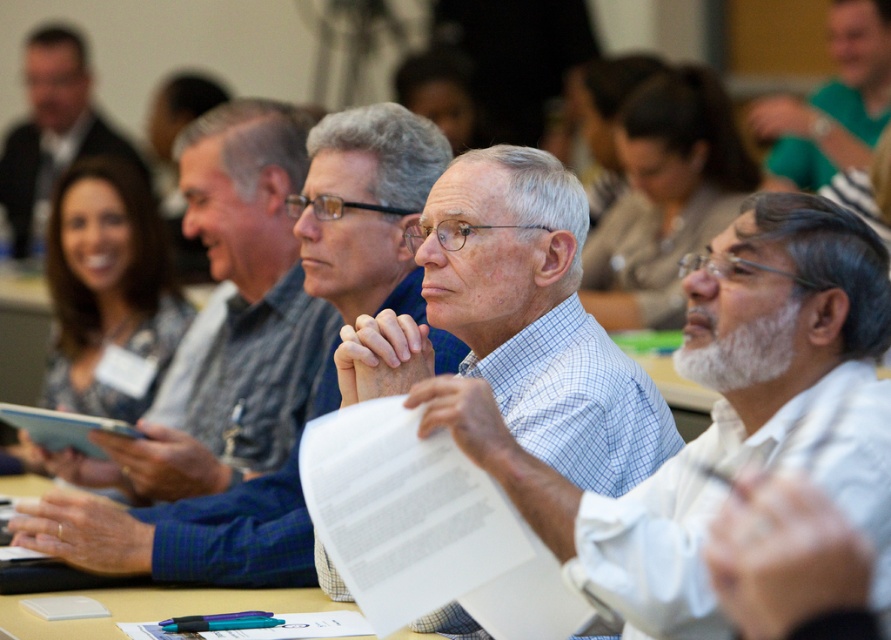
You are standing at the entrance of the conference room and see two points marked on the floor. The first point is at coordinate point [594,483] and the second point is at coordinate point [795,186]. Which point is closer to you?

Point [594,483] is in front of point [795,186], so it is closer to you.

Looking at this image, in the conference room scene, there are two men wearing white checkered shirt at center and matte black shirt at upper left. From the perspective of someone sitting at the conference table, which shirt is positioned to the right side?

The white checkered shirt at center is to the right of the matte black shirt at upper left.

You are organizing a group photo and need to arrange two people from the image. The white checkered shirt at center and the green jersey at upper right must stand side by side. Based on their positions in the image, which person should be placed on the left to avoid overlapping?

The white checkered shirt at center should be placed on the left since it is wider than the green jersey at upper right, preventing overlap.